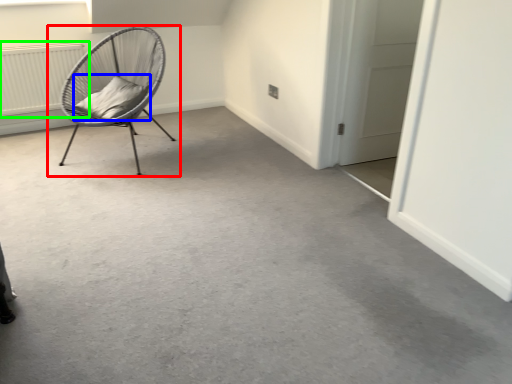
Question: Which object is positioned farthest from chair (highlighted by a red box)? Select from pillow (highlighted by a blue box) and radiator (highlighted by a green box).

Choices:
 (A) pillow
 (B) radiator

Answer: (B)